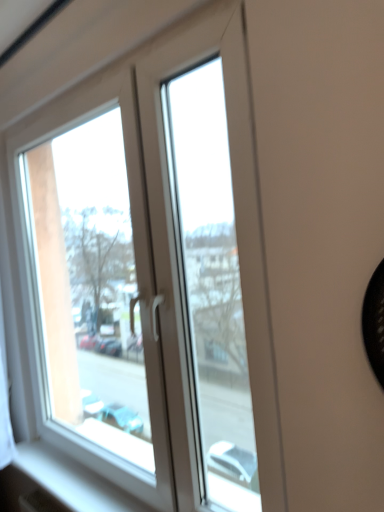
Question: In terms of width, does white plastic window at upper left look wider or thinner when compared to white smooth window sill at lower left?

Choices:
 (A) wide
 (B) thin

Answer: (B)

Question: Would you say white plastic window at upper left is to the left or to the right of white smooth window sill at lower left in the picture?

Choices:
 (A) right
 (B) left

Answer: (A)

Question: Choose the correct answer: Is white plastic window at upper left inside white smooth window sill at lower left or outside it?

Choices:
 (A) outside
 (B) inside

Answer: (A)

Question: Is white smooth window sill at lower left inside the boundaries of white plastic window at upper left, or outside?

Choices:
 (A) inside
 (B) outside

Answer: (B)

Question: In terms of height, does white smooth window sill at lower left look taller or shorter compared to white plastic window at upper left?

Choices:
 (A) tall
 (B) short

Answer: (B)

Question: Looking at the image, does white smooth window sill at lower left seem bigger or smaller compared to white plastic window at upper left?

Choices:
 (A) big
 (B) small

Answer: (B)

Question: In terms of width, does white smooth window sill at lower left look wider or thinner when compared to white plastic window at upper left?

Choices:
 (A) wide
 (B) thin

Answer: (A)